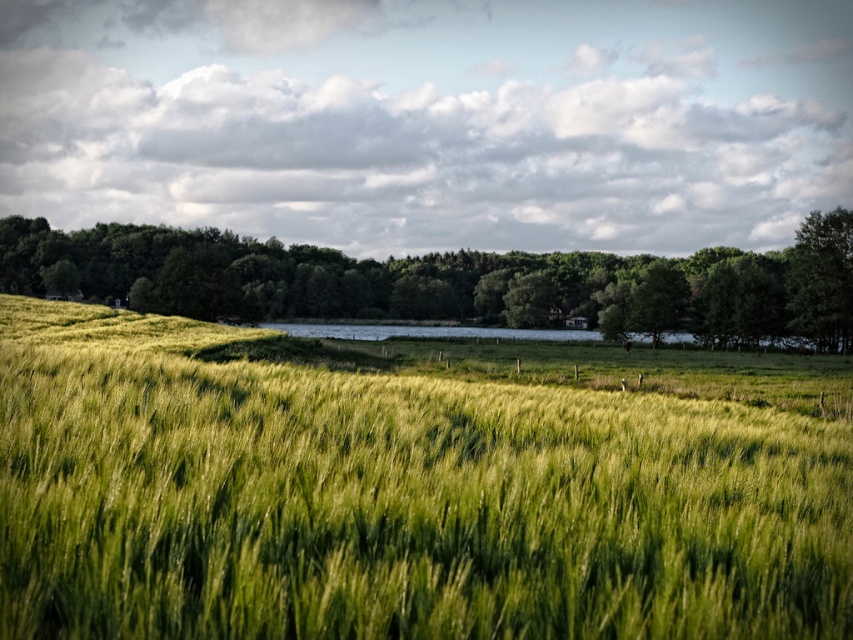
You are standing in the rural landscape and want to take a photo of both the green grassy wheat field at center and the green leafy tree at upper right. Which object should you focus on first to ensure both are in clear view?

You should focus on the green grassy wheat field at center first because it is closer to you than the green leafy tree at upper right, so adjusting focus from near to far will help both be in clear view.

You are standing at the origin point in the image. Which direction should you move to reach the green grassy wheat field at center?

The green grassy wheat field at center is located at coordinates approximately 0.786 on the x axis and 0.465 on the y axis. Since you are at the origin, you should move towards the right and slightly forward to reach it.